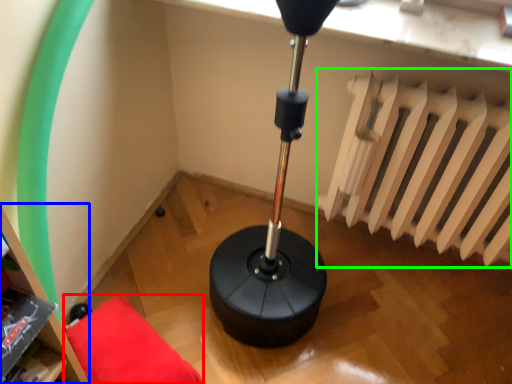
Question: Which object is the farthest from furniture (highlighted by a red box)? Choose among these: bookshelf (highlighted by a blue box) or radiator (highlighted by a green box).

Choices:
 (A) bookshelf
 (B) radiator

Answer: (B)